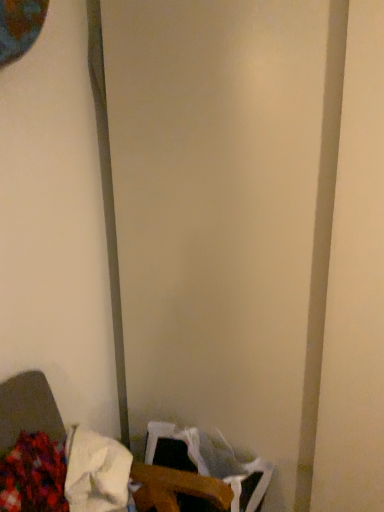
Question: From the image's perspective, is wooden table at lower left above white fabric at lower left, the 1th waste in the right-to-left sequence?

Choices:
 (A) yes
 (B) no

Answer: (B)

Question: Does wooden table at lower left come in front of white fabric at lower left, marked as the second waste in a left-to-right arrangement?

Choices:
 (A) yes
 (B) no

Answer: (A)

Question: Does wooden table at lower left have a greater height compared to white fabric at lower left, marked as the second waste in a left-to-right arrangement?

Choices:
 (A) no
 (B) yes

Answer: (B)

Question: From the image's perspective, is wooden table at lower left below white fabric at lower left, the 1th waste in the right-to-left sequence?

Choices:
 (A) no
 (B) yes

Answer: (B)

Question: Is wooden table at lower left positioned behind white fabric at lower left, the 1th waste in the right-to-left sequence?

Choices:
 (A) yes
 (B) no

Answer: (B)

Question: Is fluffy fabric at lower left, which appears as the second waste when viewed from the right, bigger or smaller than wooden table at lower left?

Choices:
 (A) small
 (B) big

Answer: (A)

Question: Is fluffy fabric at lower left, which is counted as the 1th waste, starting from the left, taller or shorter than wooden table at lower left?

Choices:
 (A) tall
 (B) short

Answer: (B)

Question: Which is correct: fluffy fabric at lower left, which appears as the second waste when viewed from the right, is inside wooden table at lower left, or outside of it?

Choices:
 (A) inside
 (B) outside

Answer: (A)

Question: From a real-world perspective, is fluffy fabric at lower left, which appears as the second waste when viewed from the right, above or below wooden table at lower left?

Choices:
 (A) below
 (B) above

Answer: (B)

Question: In the image, is white fabric at lower left, marked as the second waste in a left-to-right arrangement, positioned in front of or behind wooden table at lower left?

Choices:
 (A) front
 (B) behind

Answer: (B)

Question: In terms of size, does white fabric at lower left, marked as the second waste in a left-to-right arrangement, appear bigger or smaller than wooden table at lower left?

Choices:
 (A) small
 (B) big

Answer: (A)

Question: Do you think white fabric at lower left, marked as the second waste in a left-to-right arrangement, is within wooden table at lower left, or outside of it?

Choices:
 (A) outside
 (B) inside

Answer: (B)

Question: From the image's perspective, relative to wooden table at lower left, is white fabric at lower left, marked as the second waste in a left-to-right arrangement, above or below?

Choices:
 (A) below
 (B) above

Answer: (B)

Question: In the image, is wooden table at lower left positioned in front of or behind fluffy fabric at lower left, which is counted as the 1th waste, starting from the left?

Choices:
 (A) front
 (B) behind

Answer: (A)

Question: Looking at their shapes, would you say wooden table at lower left is wider or thinner than fluffy fabric at lower left, which is counted as the 1th waste, starting from the left?

Choices:
 (A) thin
 (B) wide

Answer: (B)